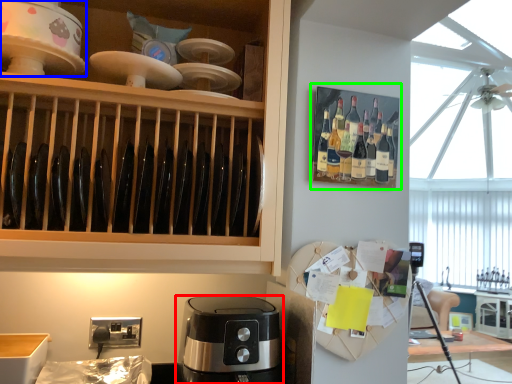
Question: Based on their relative distances, which object is farther from coffee maker (highlighted by a red box)? Choose from home appliance (highlighted by a blue box) and shelf (highlighted by a green box).

Choices:
 (A) home appliance
 (B) shelf

Answer: (A)